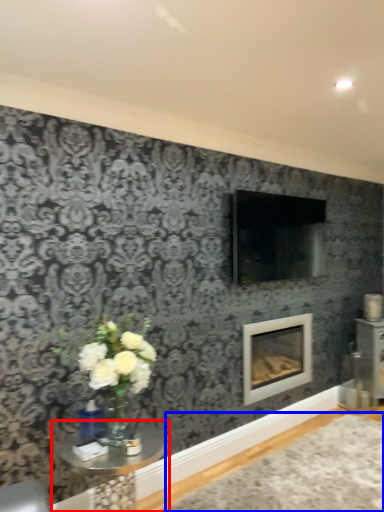
Question: Which point is further to the camera, table (highlighted by a red box) or plain (highlighted by a blue box)?

Choices:
 (A) table
 (B) plain

Answer: (B)